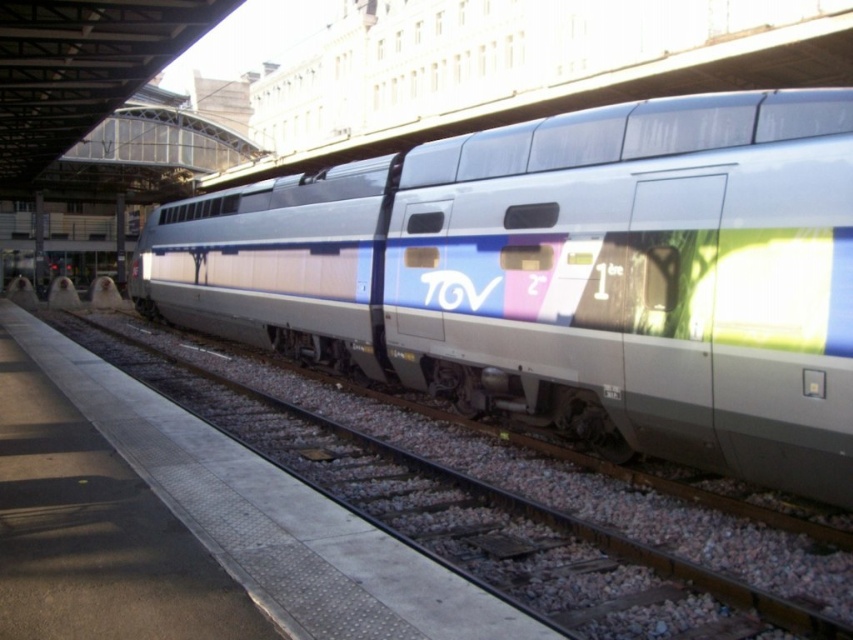
Question: Does silver metallic train at center come behind metallic track at center?

Choices:
 (A) no
 (B) yes

Answer: (B)

Question: Is silver metallic train at center further to the viewer compared to metallic track at center?

Choices:
 (A) yes
 (B) no

Answer: (A)

Question: Which point is farther to the camera?

Choices:
 (A) silver metallic train at center
 (B) metallic track at center

Answer: (A)

Question: Can you confirm if silver metallic train at center is positioned to the left of metallic track at center?

Choices:
 (A) yes
 (B) no

Answer: (A)